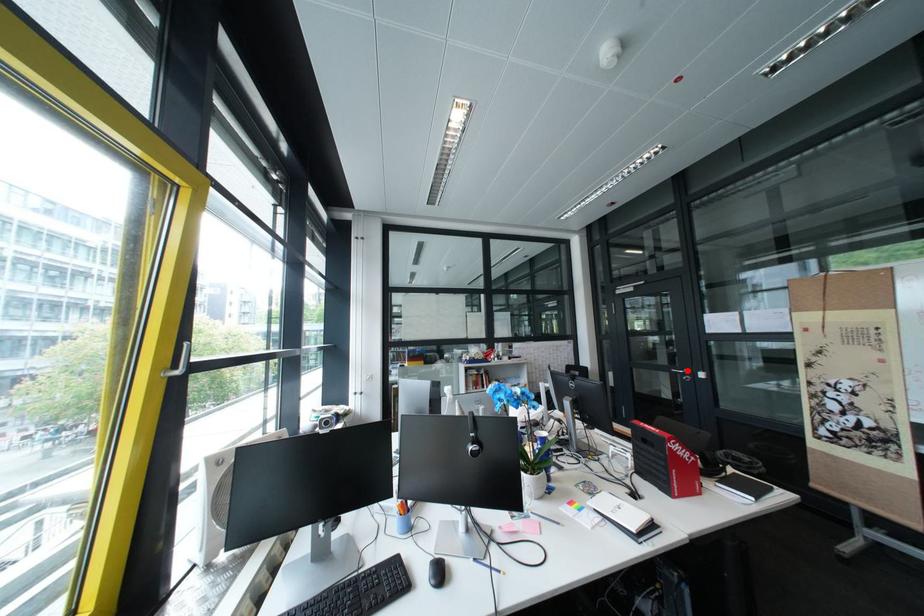
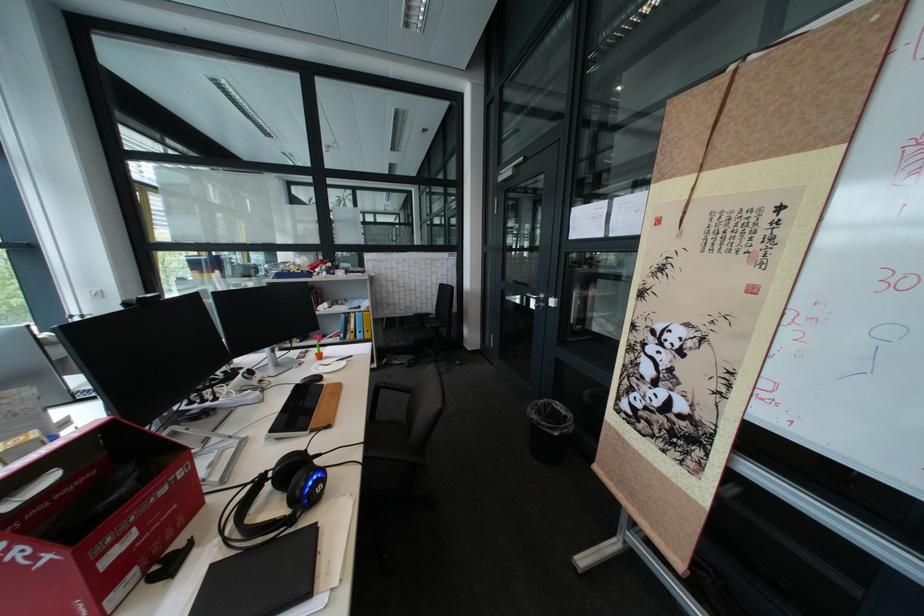
Locate, in the second image, the point that corresponds to the highlighted location in the first image.

(541, 294)